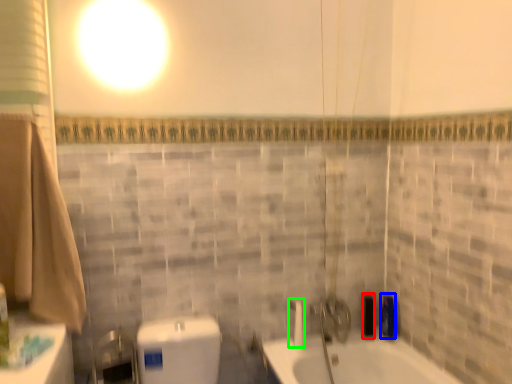
Question: Which object is the closest to the toiletry (highlighted by a red box)? Choose among these: toiletry (highlighted by a blue box) or shower (highlighted by a green box).

Choices:
 (A) toiletry
 (B) shower

Answer: (A)